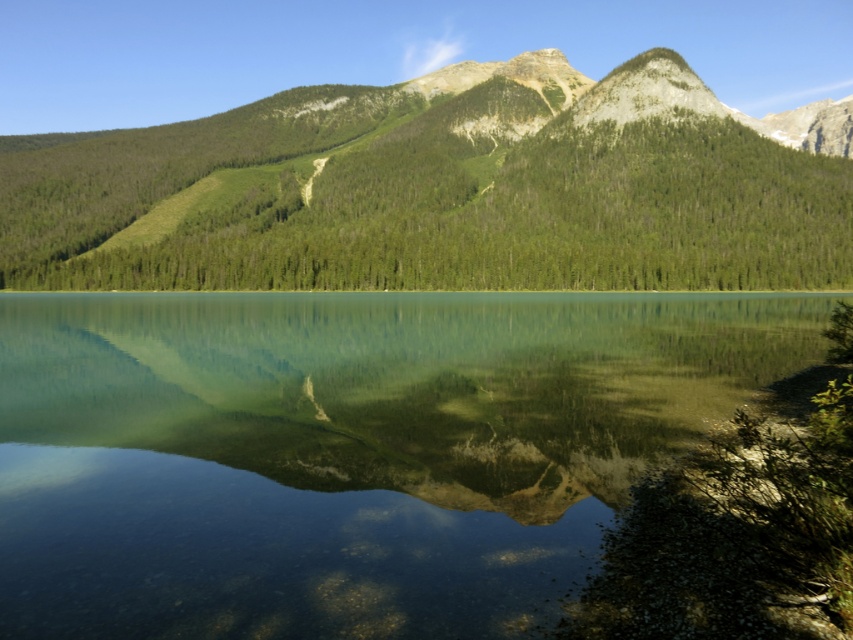
Based on the scene description, what object corresponds to the coordinate point (347, 451)?

The green glassy water at center corresponds to the coordinate point (347, 451).

You are standing at the lakeshore and want to take a photo of both the green glassy water at center and the green textured mountain range at upper center. Which object should you frame first in your camera to ensure both are in the shot?

You should frame the green textured mountain range at upper center first because the green glassy water at center is to the left of it, so positioning the mountain first will allow the water to be included on its left side in the same frame.